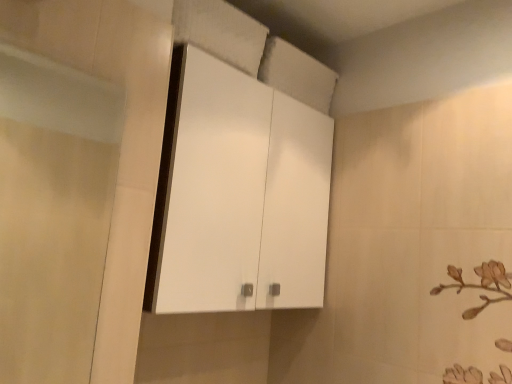
Question: Is transparent glass screen door at left bigger than white glossy cabinet at upper center?

Choices:
 (A) no
 (B) yes

Answer: (A)

Question: Can you confirm if transparent glass screen door at left is thinner than white glossy cabinet at upper center?

Choices:
 (A) yes
 (B) no

Answer: (A)

Question: Is transparent glass screen door at left oriented away from white glossy cabinet at upper center?

Choices:
 (A) no
 (B) yes

Answer: (A)

Question: Is white glossy cabinet at upper center inside transparent glass screen door at left?

Choices:
 (A) no
 (B) yes

Answer: (A)

Question: Could you tell me if transparent glass screen door at left is turned towards white glossy cabinet at upper center?

Choices:
 (A) no
 (B) yes

Answer: (A)

Question: Would you say transparent glass screen door at left is outside white glossy cabinet at upper center?

Choices:
 (A) yes
 (B) no

Answer: (A)

Question: Can we say white glossy cabinet at upper center lies outside transparent glass screen door at left?

Choices:
 (A) no
 (B) yes

Answer: (B)

Question: Is white glossy cabinet at upper center at the left side of transparent glass screen door at left?

Choices:
 (A) no
 (B) yes

Answer: (A)

Question: Are white glossy cabinet at upper center and transparent glass screen door at left located far from each other?

Choices:
 (A) no
 (B) yes

Answer: (B)

Question: Considering the relative sizes of white glossy cabinet at upper center and transparent glass screen door at left in the image provided, is white glossy cabinet at upper center bigger than transparent glass screen door at left?

Choices:
 (A) yes
 (B) no

Answer: (A)

Question: Considering the relative sizes of white glossy cabinet at upper center and transparent glass screen door at left in the image provided, is white glossy cabinet at upper center shorter than transparent glass screen door at left?

Choices:
 (A) yes
 (B) no

Answer: (B)

Question: From the image's perspective, is white glossy cabinet at upper center below transparent glass screen door at left?

Choices:
 (A) no
 (B) yes

Answer: (A)

Question: Is white glossy cabinet at upper center inside the boundaries of transparent glass screen door at left, or outside?

Choices:
 (A) inside
 (B) outside

Answer: (B)